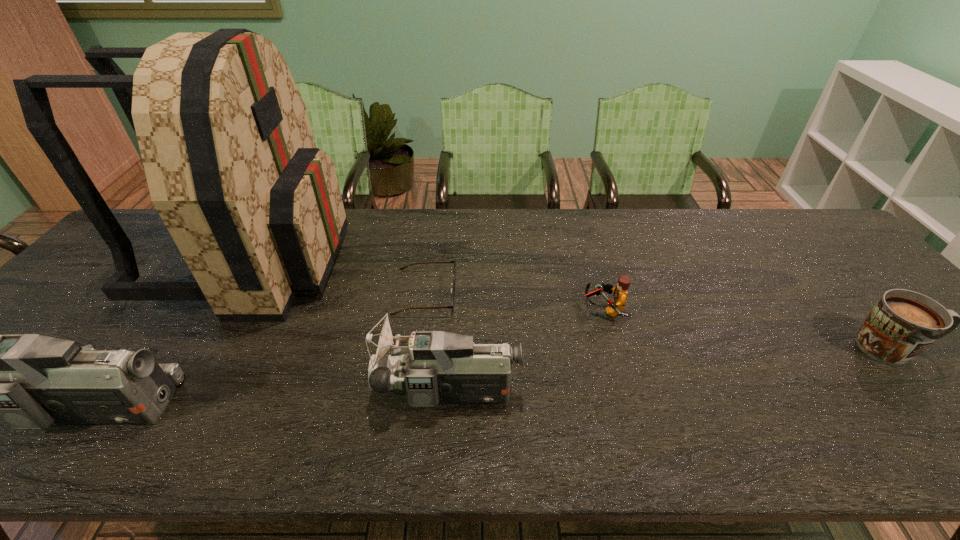
In the image, there is a desktop. In order to click on free region at the right edge in this screenshot , I will do (x=842, y=268).

This screenshot has height=540, width=960. Identify the location of free space at the far right corner of the desktop. tap(825, 246).

The width and height of the screenshot is (960, 540). In order to click on free space that is in between the spectacles and the rightmost object in this screenshot , I will do `click(659, 320)`.

At what (x,y) coordinates should I click in order to perform the action: click on empty space that is in between the backpack and the spectacles. Please return your answer as a coordinate pair (x, y). Image resolution: width=960 pixels, height=540 pixels. Looking at the image, I should click on (341, 276).

Image resolution: width=960 pixels, height=540 pixels. What are the coordinates of `free space between the backpack and the spectacles` in the screenshot? It's located at (341, 276).

Image resolution: width=960 pixels, height=540 pixels. I want to click on free space between the tallest object and the spectacles, so click(x=341, y=276).

You are a GUI agent. You are given a task and a screenshot of the screen. Output one action in this format:
    pyautogui.click(x=<x>, y=<y>)
    Task: Click on the fifth closest object relative to the left camcorder
    The width and height of the screenshot is (960, 540).
    Given the screenshot: What is the action you would take?
    pyautogui.click(x=902, y=324)

I want to click on object identified as the third closest to the rightmost object, so click(402, 268).